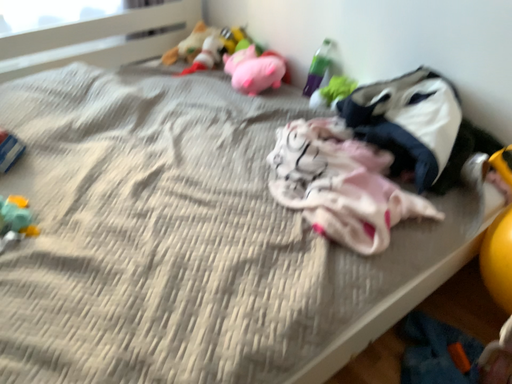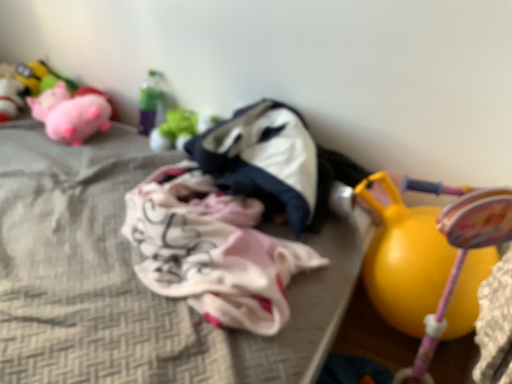
Question: How did the camera likely rotate when shooting the video?

Choices:
 (A) rotated left
 (B) rotated right

Answer: (B)